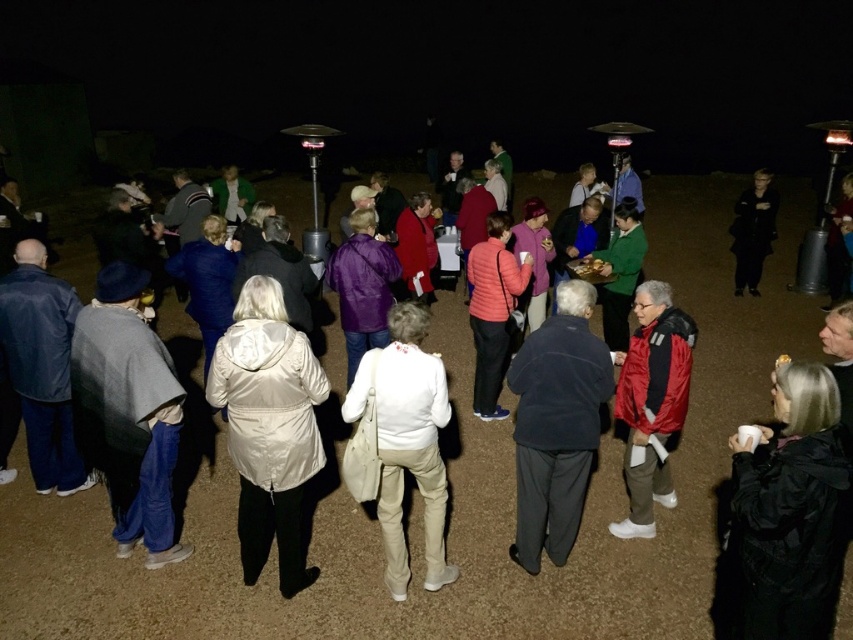
Between dark blue fleece jacket at center and white leather jacket at center, which one appears on the left side from the viewer's perspective?

white leather jacket at center is more to the left.

Identify the location of dark blue fleece jacket at center. (556, 426).

Does black matte jacket at lower right come behind dark blue fleece jacket at center?

No.

Consider the image. Measure the distance between point (x=828, y=456) and camera.

They are 8.42 feet apart.

Who is more distant from viewer, [813,449] or [518,512]?

Positioned behind is point [518,512].

Image resolution: width=853 pixels, height=640 pixels. Find the location of `black matte jacket at lower right`. black matte jacket at lower right is located at coordinates (791, 508).

This screenshot has width=853, height=640. Find the location of `denim jacket at lower left`. denim jacket at lower left is located at coordinates (129, 412).

Can you confirm if denim jacket at lower left is wider than matte pink jacket at center?

Yes.

Image resolution: width=853 pixels, height=640 pixels. In order to click on denim jacket at lower left in this screenshot , I will do `click(129, 412)`.